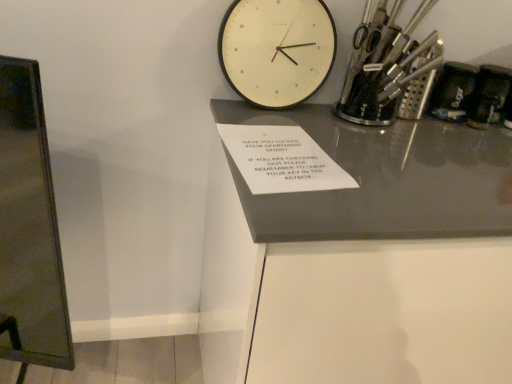
Describe the element at coordinates (276, 50) in the screenshot. I see `white matte wall clock at upper center` at that location.

The image size is (512, 384). What are the coordinates of `white glossy table at center` in the screenshot? It's located at (384, 255).

Is black plastic phone at upper right, the 2th stationery in the left-to-right sequence, bigger or smaller than metallic silver utensils at upper right, the 1th stationery viewed from the left?

black plastic phone at upper right, the 2th stationery in the left-to-right sequence, is smaller than metallic silver utensils at upper right, the 1th stationery viewed from the left.

Looking at their sizes, would you say black plastic phone at upper right, the 2th stationery in the left-to-right sequence, is wider or thinner than metallic silver utensils at upper right, which is the 2th stationery from right to left?

In the image, black plastic phone at upper right, the 2th stationery in the left-to-right sequence, appears to be more narrow than metallic silver utensils at upper right, which is the 2th stationery from right to left.

In the scene shown: Is black plastic phone at upper right, the 1th stationery viewed from the right, to the left of metallic silver utensils at upper right, the 1th stationery viewed from the left, from the viewer's perspective?

In fact, black plastic phone at upper right, the 1th stationery viewed from the right, is to the right of metallic silver utensils at upper right, the 1th stationery viewed from the left.

Does black plastic phone at upper right, the 2th stationery in the left-to-right sequence, have a lesser height compared to metallic silver utensils at upper right, the 1th stationery viewed from the left?

Correct, black plastic phone at upper right, the 2th stationery in the left-to-right sequence, is not as tall as metallic silver utensils at upper right, the 1th stationery viewed from the left.

Find the location of `wall clock above the black plastic phone at upper right, the 1th stationery viewed from the right (from a real-world perspective)`. wall clock above the black plastic phone at upper right, the 1th stationery viewed from the right (from a real-world perspective) is located at coordinates (276, 50).

Is black plastic phone at upper right, the 2th stationery in the left-to-right sequence, located within white matte wall clock at upper center?

Actually, black plastic phone at upper right, the 2th stationery in the left-to-right sequence, is outside white matte wall clock at upper center.

Is point (276, 19) closer to camera compared to point (473, 73)?

That is True.

Who is taller, white matte wall clock at upper center or black plastic phone at upper right, the 1th stationery viewed from the right?

white matte wall clock at upper center is taller.

Considering the relative positions of white glossy table at center and black plastic phone at upper right, the 1th stationery viewed from the right, in the image provided, is white glossy table at center to the left or to the right of black plastic phone at upper right, the 1th stationery viewed from the right,?

Clearly, white glossy table at center is on the left of black plastic phone at upper right, the 1th stationery viewed from the right, in the image.

In the scene shown: Can you confirm if white glossy table at center is thinner than black plastic phone at upper right, the 2th stationery in the left-to-right sequence?

No, white glossy table at center is not thinner than black plastic phone at upper right, the 2th stationery in the left-to-right sequence.

In the scene shown: Which object is closer to the camera, white glossy table at center or black plastic phone at upper right, the 2th stationery in the left-to-right sequence?

white glossy table at center is more forward.

Is white glossy table at center turned away from black plastic phone at upper right, the 2th stationery in the left-to-right sequence?

white glossy table at center does not have its back to black plastic phone at upper right, the 2th stationery in the left-to-right sequence.

You are a GUI agent. You are given a task and a screenshot of the screen. Output one action in this format:
    pyautogui.click(x=<x>, y=<y>)
    Task: Click on the table below the black plastic phone at upper right, the 1th stationery viewed from the right (from a real-world perspective)
    The height and width of the screenshot is (384, 512).
    Given the screenshot: What is the action you would take?
    pyautogui.click(x=384, y=255)

Can you see black plastic phone at upper right, the 2th stationery in the left-to-right sequence, touching white glossy table at center?

No, black plastic phone at upper right, the 2th stationery in the left-to-right sequence, is not making contact with white glossy table at center.

From their relative heights in the image, would you say black plastic phone at upper right, the 2th stationery in the left-to-right sequence, is taller or shorter than white glossy table at center?

black plastic phone at upper right, the 2th stationery in the left-to-right sequence, is shorter than white glossy table at center.

From a real-world perspective, is black plastic phone at upper right, the 2th stationery in the left-to-right sequence, under white glossy table at center?

No.

Considering the positions of objects metallic silver utensils at upper right, the 1th stationery viewed from the left, and white glossy table at center in the image provided, who is more to the right, metallic silver utensils at upper right, the 1th stationery viewed from the left, or white glossy table at center?

white glossy table at center.

Does metallic silver utensils at upper right, which is the 2th stationery from right to left, come in front of white glossy table at center?

No, metallic silver utensils at upper right, which is the 2th stationery from right to left, is further to the viewer.

Does metallic silver utensils at upper right, the 1th stationery viewed from the left, have a lesser height compared to white glossy table at center?

Indeed, metallic silver utensils at upper right, the 1th stationery viewed from the left, has a lesser height compared to white glossy table at center.

Is point (425, 41) closer or farther from the camera than point (489, 165)?

Point (425, 41) is farther from the camera than point (489, 165).

Is metallic silver utensils at upper right, which is the 2th stationery from right to left, surrounded by white glossy table at center?

No, white glossy table at center does not contain metallic silver utensils at upper right, which is the 2th stationery from right to left.

Which of these two, white glossy table at center or metallic silver utensils at upper right, which is the 2th stationery from right to left, stands shorter?

metallic silver utensils at upper right, which is the 2th stationery from right to left, is shorter.

Which object is positioned more to the left, white glossy table at center or metallic silver utensils at upper right, the 1th stationery viewed from the left?

From the viewer's perspective, metallic silver utensils at upper right, the 1th stationery viewed from the left, appears more on the left side.

Is metallic silver utensils at upper right, which is the 2th stationery from right to left, not close to black plastic phone at upper right, the 1th stationery viewed from the right?

No.

Looking at this image, can you confirm if metallic silver utensils at upper right, the 1th stationery viewed from the left, is thinner than black plastic phone at upper right, the 2th stationery in the left-to-right sequence?

No, metallic silver utensils at upper right, the 1th stationery viewed from the left, is not thinner than black plastic phone at upper right, the 2th stationery in the left-to-right sequence.

Which point is more distant from viewer, [345,117] or [456,81]?

The point [456,81] is behind.

Is metallic silver utensils at upper right, the 1th stationery viewed from the left, to the left of black plastic phone at upper right, the 1th stationery viewed from the right, from the viewer's perspective?

Correct, you'll find metallic silver utensils at upper right, the 1th stationery viewed from the left, to the left of black plastic phone at upper right, the 1th stationery viewed from the right.

Where is `stationery located in front of the black plastic phone at upper right, the 2th stationery in the left-to-right sequence`? The image size is (512, 384). stationery located in front of the black plastic phone at upper right, the 2th stationery in the left-to-right sequence is located at coordinates (385, 65).

You are a GUI agent. You are given a task and a screenshot of the screen. Output one action in this format:
    pyautogui.click(x=<x>, y=<y>)
    Task: Click on the wall clock lying on the left of black plastic phone at upper right, the 1th stationery viewed from the right
    This screenshot has height=384, width=512.
    Given the screenshot: What is the action you would take?
    pyautogui.click(x=276, y=50)

From the picture: Which object lies further to the anchor point metallic silver utensils at upper right, which is the 2th stationery from right to left, black plastic phone at upper right, the 2th stationery in the left-to-right sequence, or white matte wall clock at upper center?

white matte wall clock at upper center is further to metallic silver utensils at upper right, which is the 2th stationery from right to left.

Which object lies nearer to the anchor point black plastic phone at upper right, the 2th stationery in the left-to-right sequence, white glossy table at center or white matte wall clock at upper center?

white matte wall clock at upper center is closer to black plastic phone at upper right, the 2th stationery in the left-to-right sequence.

Estimate the real-world distances between objects in this image. Which object is closer to metallic silver utensils at upper right, which is the 2th stationery from right to left, black plastic phone at upper right, the 1th stationery viewed from the right, or white glossy table at center?

black plastic phone at upper right, the 1th stationery viewed from the right.

Based on their spatial positions, is white matte wall clock at upper center or white glossy table at center further from metallic silver utensils at upper right, the 1th stationery viewed from the left?

Based on the image, white glossy table at center appears to be further to metallic silver utensils at upper right, the 1th stationery viewed from the left.

From the image, which object appears to be farther from white matte wall clock at upper center, black plastic phone at upper right, the 1th stationery viewed from the right, or metallic silver utensils at upper right, which is the 2th stationery from right to left?

black plastic phone at upper right, the 1th stationery viewed from the right.

Which object lies nearer to the anchor point white matte wall clock at upper center, white glossy table at center or metallic silver utensils at upper right, the 1th stationery viewed from the left?

Among the two, metallic silver utensils at upper right, the 1th stationery viewed from the left, is located nearer to white matte wall clock at upper center.

Estimate the real-world distances between objects in this image. Which object is further from black plastic phone at upper right, the 1th stationery viewed from the right, white glossy table at center or metallic silver utensils at upper right, the 1th stationery viewed from the left?

white glossy table at center is further to black plastic phone at upper right, the 1th stationery viewed from the right.

Estimate the real-world distances between objects in this image. Which object is closer to white glossy table at center, metallic silver utensils at upper right, the 1th stationery viewed from the left, or white matte wall clock at upper center?

Based on the image, metallic silver utensils at upper right, the 1th stationery viewed from the left, appears to be nearer to white glossy table at center.

Identify the location of stationery between metallic silver utensils at upper right, the 1th stationery viewed from the left, and white glossy table at center in the up-down direction. The height and width of the screenshot is (384, 512). coord(452,92).

Find the location of `stationery between white matte wall clock at upper center and black plastic phone at upper right, the 1th stationery viewed from the right, in the horizontal direction`. stationery between white matte wall clock at upper center and black plastic phone at upper right, the 1th stationery viewed from the right, in the horizontal direction is located at coordinates (385, 65).